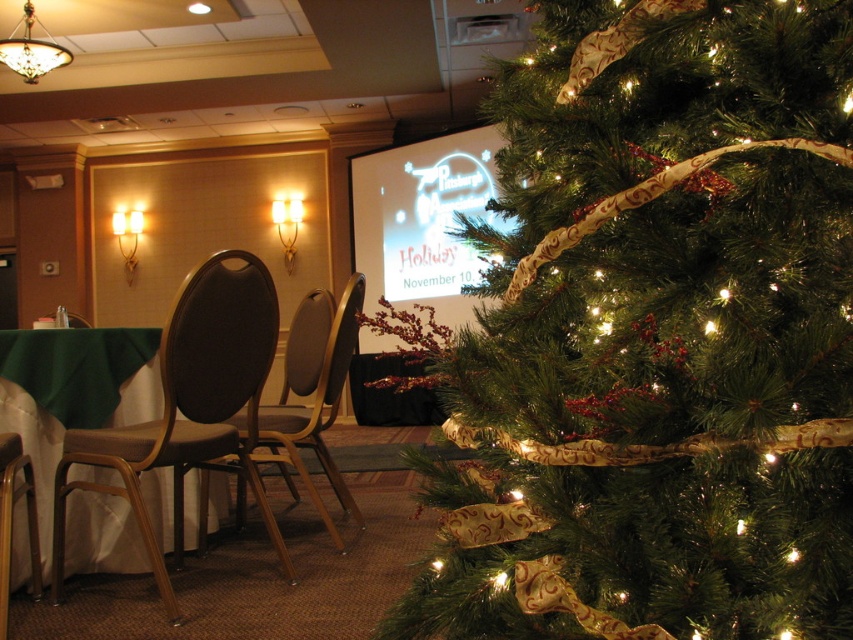
You are sitting in the room and need to move from the brown fabric chair at left to the matte brown chair at left. Which direction should you move to reach your destination?

You should move to the left to reach the matte brown chair at left because the brown fabric chair at left is currently to the right of it.

You are a guest at the Pittsburgh Holiday Market event and need to sit down. You see a matte brown chair at left and a brown wood chair at left. Which chair is taller?

The matte brown chair at left is much taller than the brown wood chair at left.

You are attending the Pittsburgh Holiday Market event and need to sit down. You see two chairs at the left side of the room. Which chair is positioned higher up, the matte brown chair at left or the brown wood chair at left?

The matte brown chair at left is located above the brown wood chair at left, so it is positioned higher up.